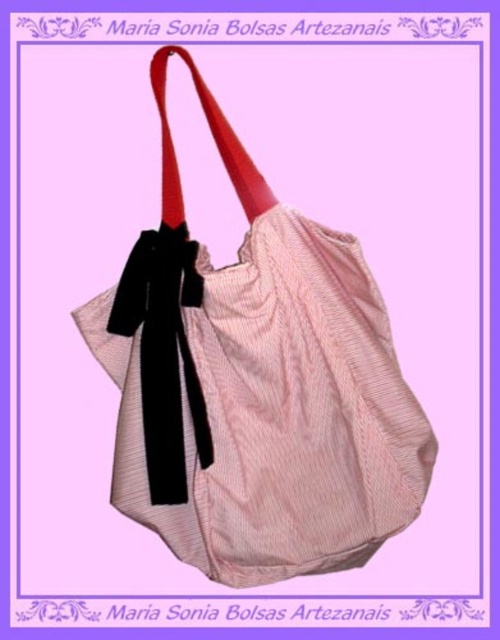
Question: Is pink striped fabric shoulder bag at center bigger than black velvet tie at center?

Choices:
 (A) yes
 (B) no

Answer: (A)

Question: Which point is closer to the camera taking this photo?

Choices:
 (A) (284, 246)
 (B) (172, 369)

Answer: (A)

Question: Can you confirm if pink striped fabric shoulder bag at center is wider than black velvet tie at center?

Choices:
 (A) no
 (B) yes

Answer: (B)

Question: Does pink striped fabric shoulder bag at center have a lesser width compared to black velvet tie at center?

Choices:
 (A) no
 (B) yes

Answer: (A)

Question: Which point is farther to the camera?

Choices:
 (A) (362, 548)
 (B) (158, 436)

Answer: (B)

Question: Which point is closer to the camera?

Choices:
 (A) black velvet tie at center
 (B) pink striped fabric shoulder bag at center

Answer: (B)